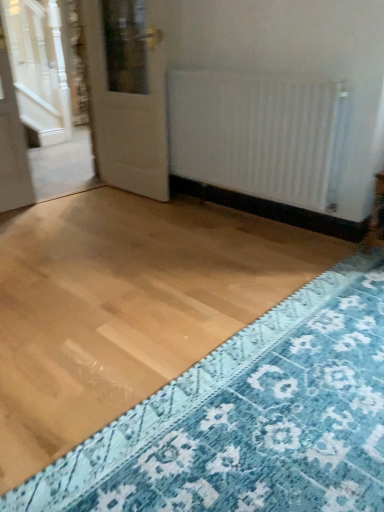
Locate an element on the screen. free space to the left of white glossy door at upper left is located at coordinates (92, 199).